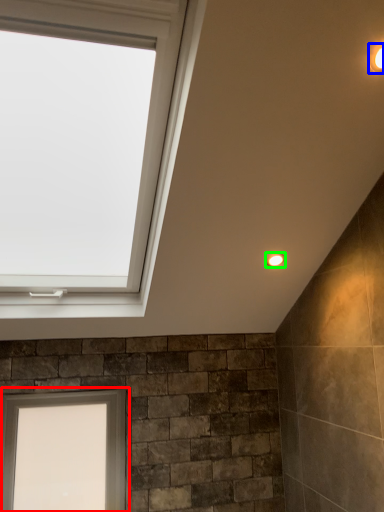
Question: Which is farther away from window (highlighted by a red box)? light fixture (highlighted by a blue box) or light fixture (highlighted by a green box)?

Choices:
 (A) light fixture
 (B) light fixture

Answer: (A)